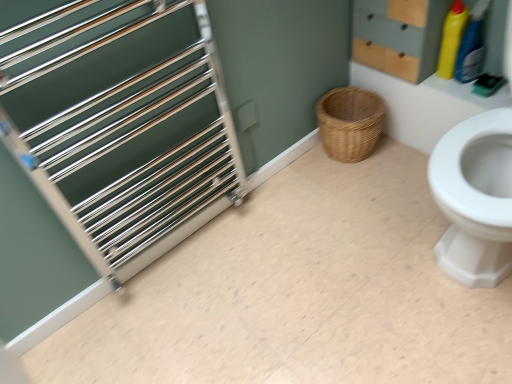
Find the location of `space that is in front of woven natural basket at lower center`. space that is in front of woven natural basket at lower center is located at coordinates (372, 185).